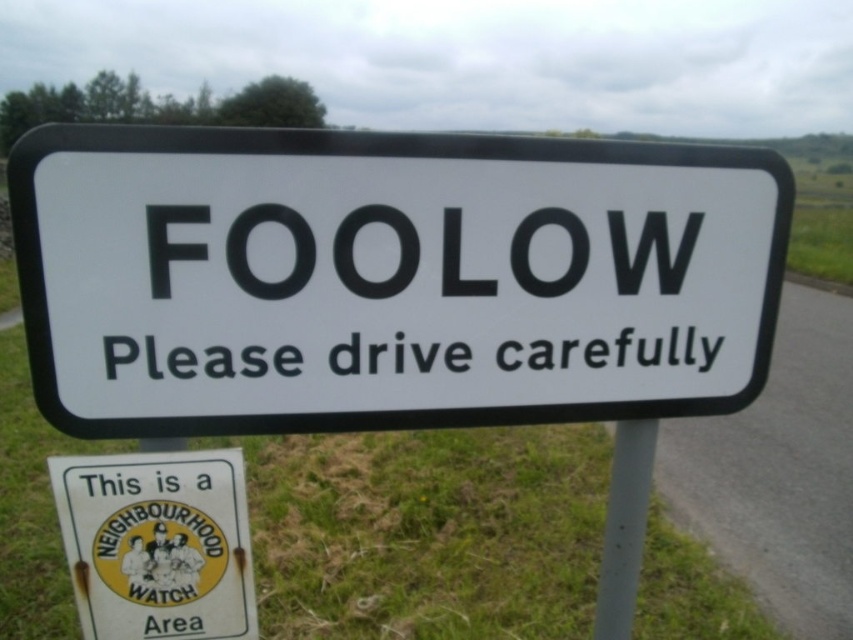
Does yellow paper sign at lower left appear on the left side of black matte text at center?

Correct, you'll find yellow paper sign at lower left to the left of black matte text at center.

Who is higher up, yellow paper sign at lower left or black matte text at center?

black matte text at center

Identify the location of yellow paper sign at lower left. (157, 544).

Can you confirm if white plastic sign at center is taller than white metallic pole at center?

Incorrect, white plastic sign at center's height is not larger of white metallic pole at center's.

Can you confirm if white plastic sign at center is positioned to the left of white metallic pole at center?

Yes, white plastic sign at center is to the left of white metallic pole at center.

Who is more forward, (15, 189) or (630, 484)?

Point (15, 189) is in front.

Where is `white plastic sign at center`? The height and width of the screenshot is (640, 853). white plastic sign at center is located at coordinates (x=387, y=278).

Does white plastic sign at center have a smaller size compared to black matte text at center?

Actually, white plastic sign at center might be larger than black matte text at center.

Is white plastic sign at center shorter than black matte text at center?

No, white plastic sign at center is not shorter than black matte text at center.

Does point (534, 179) lie behind point (515, 371)?

No.

At what (x,y) coordinates should I click in order to perform the action: click on white plastic sign at center. Please return your answer as a coordinate pair (x, y). This screenshot has height=640, width=853. Looking at the image, I should click on (387, 278).